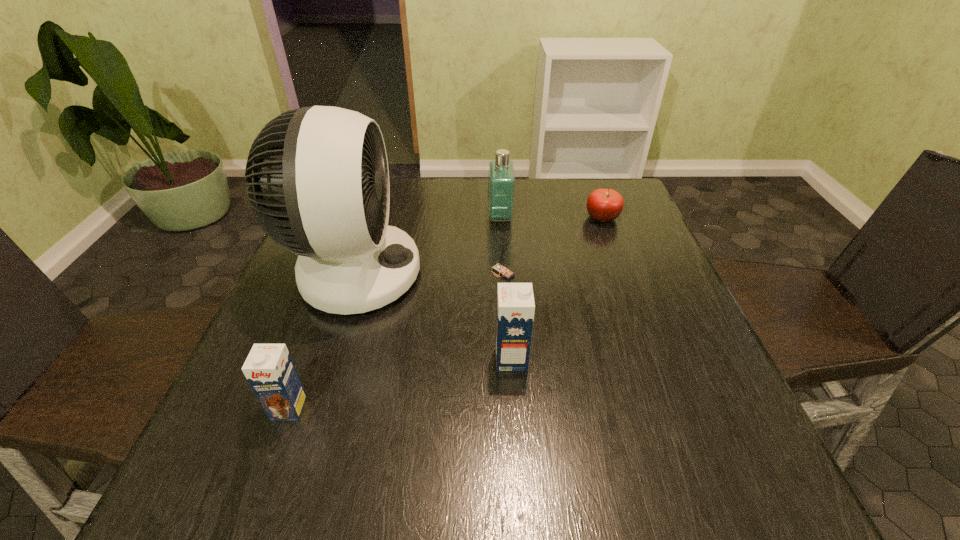
Locate an element on the screen. free space between the rightmost object and the perfume is located at coordinates tap(551, 217).

Where is `vacant area between the nearer chocolate milk and the perfume`? vacant area between the nearer chocolate milk and the perfume is located at coordinates (395, 313).

The width and height of the screenshot is (960, 540). In order to click on free space that is in between the nearer chocolate milk and the tallest object in this screenshot , I will do `click(322, 341)`.

What are the coordinates of `unoccupied area between the rightmost object and the tallest object` in the screenshot? It's located at (478, 246).

In order to click on free space that is in between the matchbox and the fan in this screenshot , I will do `click(429, 274)`.

Choose which object is the nearest neighbor to the taller chocolate milk. Please provide its 2D coordinates. Your answer should be formatted as a tuple, i.e. [(x, y)], where the tuple contains the x and y coordinates of a point satisfying the conditions above.

[(318, 184)]

The width and height of the screenshot is (960, 540). Identify the location of object that stands as the fourth closest to the perfume. (515, 301).

The height and width of the screenshot is (540, 960). What are the coordinates of `free space in the image that satisfies the following two spatial constraints: 1. on the front label of the perfume; 2. on the front label of the left chocolate milk` in the screenshot? It's located at (512, 408).

At what (x,y) coordinates should I click in order to perform the action: click on free space that satisfies the following two spatial constraints: 1. on the front side of the matchbox; 2. on the grille of the fan. Please return your answer as a coordinate pair (x, y). The width and height of the screenshot is (960, 540). Looking at the image, I should click on (503, 274).

Locate an element on the screen. The width and height of the screenshot is (960, 540). vacant space that satisfies the following two spatial constraints: 1. on the front side of the apple; 2. on the grille of the tallest object is located at coordinates [623, 274].